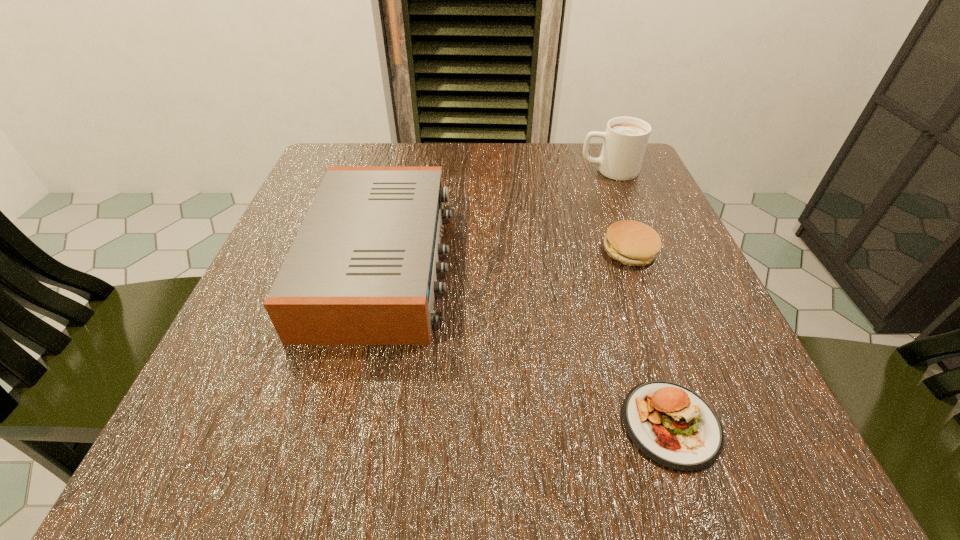
Find the location of a particular element. This screenshot has height=540, width=960. free space that satisfies the following two spatial constraints: 1. on the front side of the second shortest object; 2. on the front panel of the leftmost object is located at coordinates (635, 263).

Locate an element on the screen. free space in the image that satisfies the following two spatial constraints: 1. on the back side of the nearer patty (food); 2. on the left side of the farther patty (food) is located at coordinates (613, 251).

Identify the location of free space that satisfies the following two spatial constraints: 1. on the front panel of the nearest object; 2. on the left side of the radio receiver. (344, 424).

What are the coordinates of `free space that satisfies the following two spatial constraints: 1. on the side with the handle of the farthest object; 2. on the front side of the nearest object` in the screenshot? It's located at (711, 424).